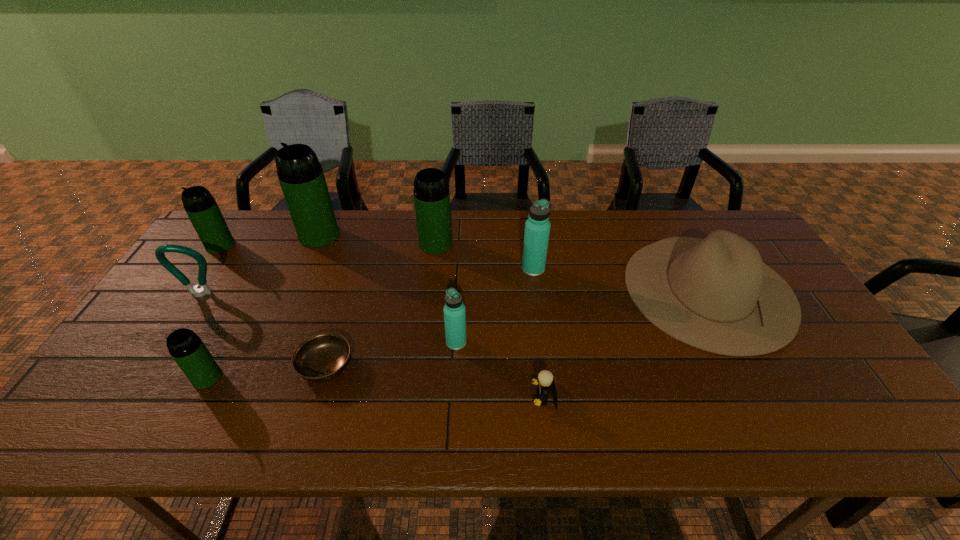
Find the location of a particular element. Image resolution: width=960 pixels, height=540 pixels. sombrero is located at coordinates coord(716,294).

Identify the location of the smallest green thermos bottle. (187, 349).

Find the location of a particular element. The image size is (960, 540). the nearest green thermos bottle is located at coordinates (187, 349).

Where is `the left aqua thermos bottle`? the left aqua thermos bottle is located at coordinates (454, 310).

Locate an element on the screen. Image resolution: width=960 pixels, height=540 pixels. the fifth farthest thermos bottle is located at coordinates (454, 310).

What are the coordinates of `the second shortest object` in the screenshot? It's located at (545, 381).

Where is `soup bowl`? The image size is (960, 540). soup bowl is located at coordinates (320, 358).

Locate an element on the screen. This screenshot has height=540, width=960. the shortest object is located at coordinates (320, 358).

Locate an element on the screen. The width and height of the screenshot is (960, 540). vacant space located 0.230m from the spout of the third green thermos bottle from left to right is located at coordinates click(x=292, y=299).

Image resolution: width=960 pixels, height=540 pixels. Identify the location of vacant region located from the spout of the fifth object from right to left. (432, 281).